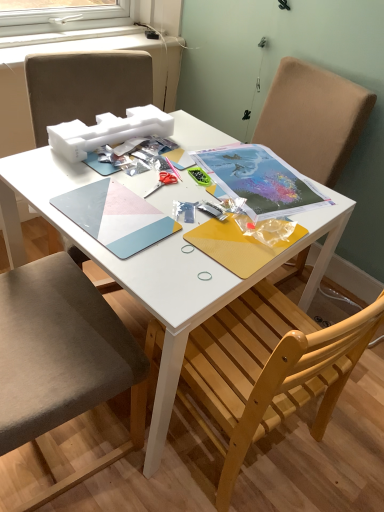
Question: Is matte paper notebook at center, which is the second notebook from left to right, positioned before fabric cushioned chair at left, which ranks as the first chair in left-to-right order?

Choices:
 (A) no
 (B) yes

Answer: (A)

Question: Is matte paper notebook at center, which is the second notebook from left to right, not inside fabric cushioned chair at left, which ranks as the first chair in left-to-right order?

Choices:
 (A) yes
 (B) no

Answer: (A)

Question: From a real-world perspective, is matte paper notebook at center, which is the second notebook from left to right, on top of fabric cushioned chair at left, which appears as the second chair when viewed from the right?

Choices:
 (A) no
 (B) yes

Answer: (B)

Question: Is matte paper notebook at center, the 1th notebook from the right, far away from fabric cushioned chair at left, which appears as the second chair when viewed from the right?

Choices:
 (A) no
 (B) yes

Answer: (A)

Question: Can you confirm if matte paper notebook at center, which is the second notebook from left to right, is positioned to the right of fabric cushioned chair at left, which ranks as the first chair in left-to-right order?

Choices:
 (A) no
 (B) yes

Answer: (B)

Question: Considering the relative sizes of matte paper notebook at center, which is the second notebook from left to right, and fabric cushioned chair at left, which appears as the second chair when viewed from the right, in the image provided, is matte paper notebook at center, which is the second notebook from left to right, smaller than fabric cushioned chair at left, which appears as the second chair when viewed from the right,?

Choices:
 (A) no
 (B) yes

Answer: (B)

Question: From a real-world perspective, is matte plastic notebook at center, which ranks as the 1th notebook in left-to-right order, over wooden chair at lower right, which is the 1th chair from right to left?

Choices:
 (A) no
 (B) yes

Answer: (B)

Question: Considering the relative sizes of matte plastic notebook at center, which ranks as the 1th notebook in left-to-right order, and wooden chair at lower right, placed as the 2th chair when sorted from left to right, in the image provided, is matte plastic notebook at center, which ranks as the 1th notebook in left-to-right order, shorter than wooden chair at lower right, placed as the 2th chair when sorted from left to right,?

Choices:
 (A) yes
 (B) no

Answer: (A)

Question: Is wooden chair at lower right, which is the 1th chair from right to left, inside matte plastic notebook at center, the 2th notebook when ordered from right to left?

Choices:
 (A) yes
 (B) no

Answer: (B)

Question: Are matte plastic notebook at center, the 2th notebook when ordered from right to left, and wooden chair at lower right, placed as the 2th chair when sorted from left to right, located far from each other?

Choices:
 (A) yes
 (B) no

Answer: (B)

Question: From a real-world perspective, is matte plastic notebook at center, the 2th notebook when ordered from right to left, below wooden chair at lower right, which is the 1th chair from right to left?

Choices:
 (A) yes
 (B) no

Answer: (B)

Question: Is the depth of matte plastic notebook at center, the 2th notebook when ordered from right to left, less than that of wooden chair at lower right, which is the 1th chair from right to left?

Choices:
 (A) no
 (B) yes

Answer: (A)

Question: Is matte plastic notebook at center, which ranks as the 1th notebook in left-to-right order, looking in the opposite direction of metallic silver scissors at center?

Choices:
 (A) no
 (B) yes

Answer: (B)